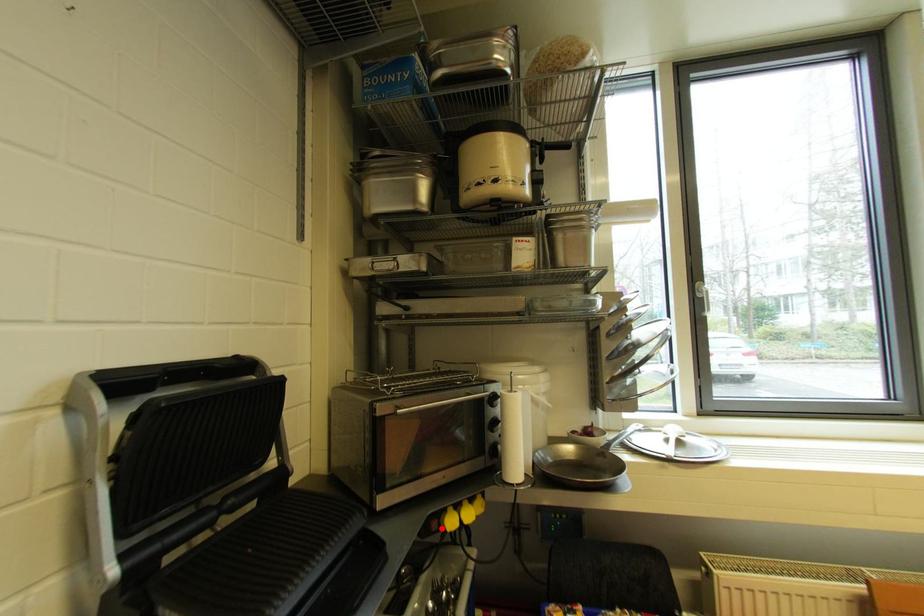
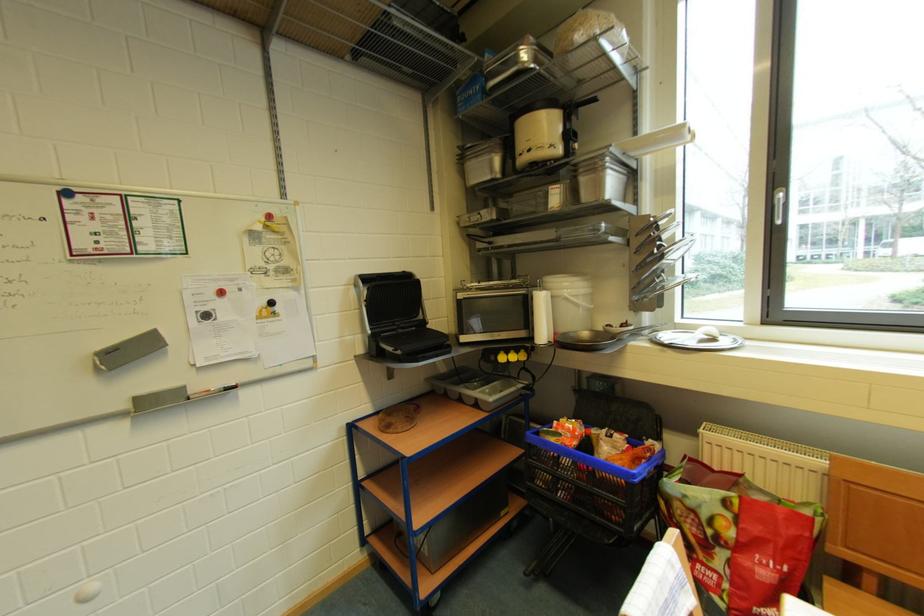
Where in the second image is the point corresponding to the highlighted location from the first image?

(500, 361)